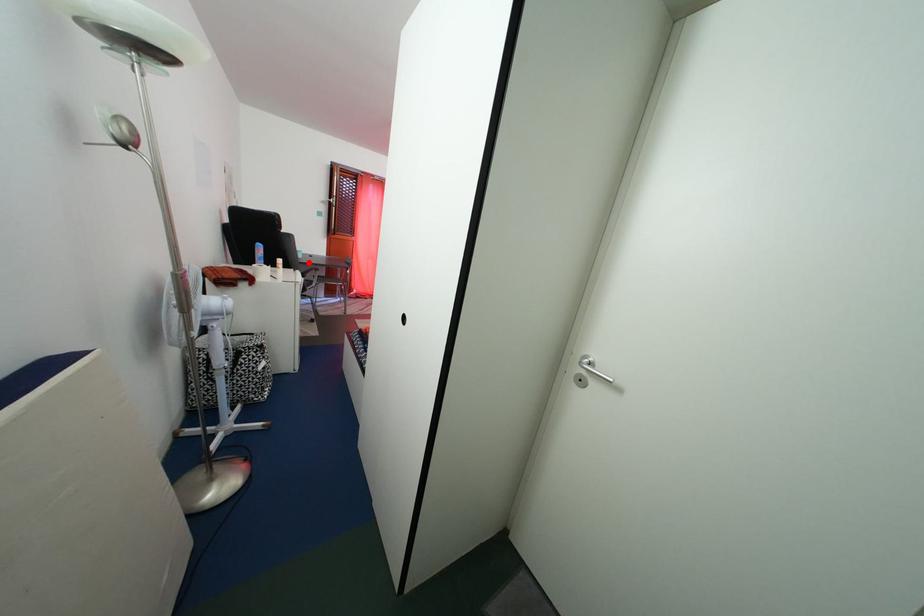
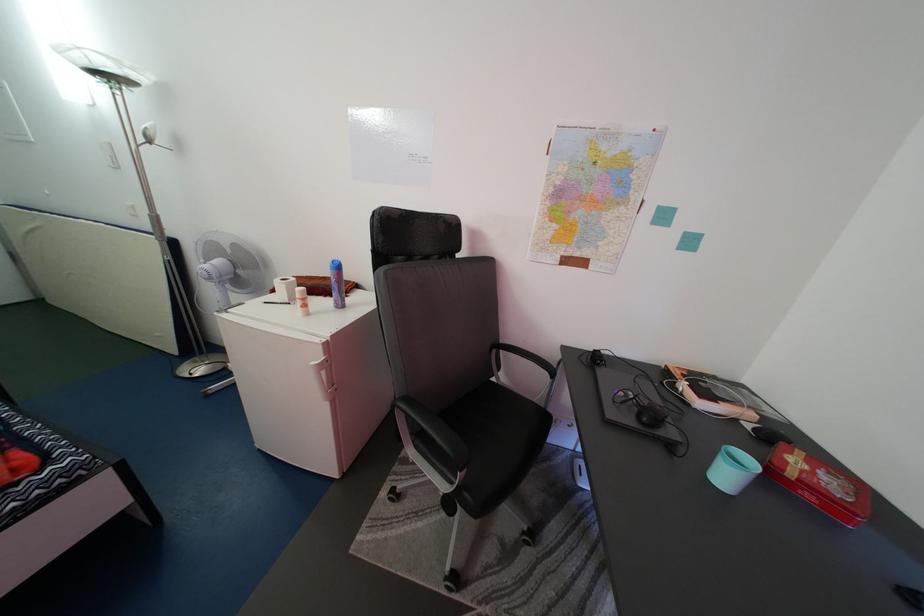
Question: I am providing you with two images of the same scene from different viewpoints. A red point is shown in image1. For the corresponding object point in image2, is it positioned nearer or farther from the camera?

Choices:
 (A) Nearer
 (B) Farther

Answer: (B)